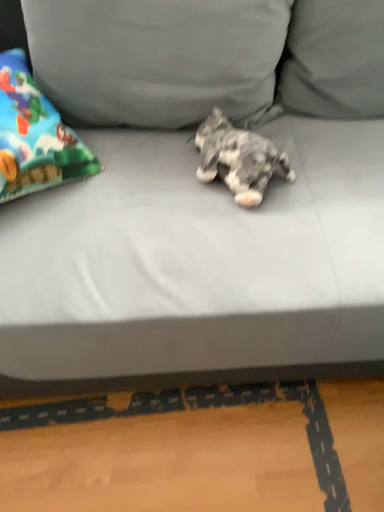
At what (x,y) coordinates should I click in order to perform the action: click on free spot to the left of fluffy gray dog at center. Please return your answer as a coordinate pair (x, y). This screenshot has height=512, width=384. Looking at the image, I should click on (152, 177).